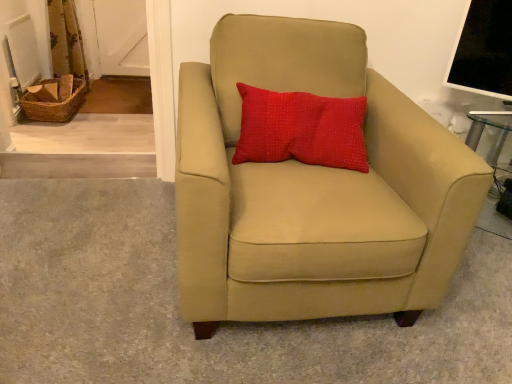
Describe the element at coordinates (314, 189) in the screenshot. The width and height of the screenshot is (512, 384). I see `suede beige armchair at center` at that location.

You are a GUI agent. You are given a task and a screenshot of the screen. Output one action in this format:
    pyautogui.click(x=<x>, y=<y>)
    Task: Click on the red textured pillow at upper center
    The height and width of the screenshot is (384, 512).
    Given the screenshot: What is the action you would take?
    pyautogui.click(x=301, y=129)

Image resolution: width=512 pixels, height=384 pixels. I want to click on suede beige armchair at center, so click(x=314, y=189).

Is floral fabric curtain at upper left bigger than red textured pillow at upper center?

Yes.

In the image, is floral fabric curtain at upper left positioned in front of or behind red textured pillow at upper center?

Clearly, floral fabric curtain at upper left is behind red textured pillow at upper center.

Between point (82, 42) and point (269, 160), which one is positioned in front?

The point (269, 160) is closer.

From a real-world perspective, is floral fabric curtain at upper left positioned above or below red textured pillow at upper center?

In terms of real-world spatial position, floral fabric curtain at upper left is below red textured pillow at upper center.

There is a floral fabric curtain at upper left. Where is `pillow above it (from a real-world perspective)`? pillow above it (from a real-world perspective) is located at coordinates (301, 129).

Does red textured pillow at upper center have a smaller size compared to floral fabric curtain at upper left?

Correct, red textured pillow at upper center occupies less space than floral fabric curtain at upper left.

From a real-world perspective, which is physically above, red textured pillow at upper center or floral fabric curtain at upper left?

In real-world perspective, red textured pillow at upper center is above.

Is red textured pillow at upper center not close to floral fabric curtain at upper left?

Yes, red textured pillow at upper center and floral fabric curtain at upper left are quite far apart.

Can you confirm if red textured pillow at upper center is taller than suede beige armchair at center?

No.

From the image's perspective, relative to suede beige armchair at center, is red textured pillow at upper center above or below?

red textured pillow at upper center is situated higher than suede beige armchair at center in the image.

Between red textured pillow at upper center and suede beige armchair at center, which one has larger width?

With larger width is suede beige armchair at center.

Is suede beige armchair at center completely or partially inside red textured pillow at upper center?

Definitely not — suede beige armchair at center is not inside red textured pillow at upper center.

Considering the sizes of floral fabric curtain at upper left and suede beige armchair at center in the image, is floral fabric curtain at upper left taller or shorter than suede beige armchair at center?

Considering their sizes, floral fabric curtain at upper left has less height than suede beige armchair at center.

Between point (53, 35) and point (288, 81), which one is positioned behind?

The point (53, 35) is farther from the camera.

Is floral fabric curtain at upper left aimed at suede beige armchair at center?

No, floral fabric curtain at upper left is not aimed at suede beige armchair at center.

Between floral fabric curtain at upper left and suede beige armchair at center, which one has larger width?

suede beige armchair at center.

Looking at the image, does suede beige armchair at center seem bigger or smaller compared to red textured pillow at upper center?

In the image, suede beige armchair at center appears to be larger than red textured pillow at upper center.

Is suede beige armchair at center inside the boundaries of red textured pillow at upper center, or outside?

suede beige armchair at center exists outside the volume of red textured pillow at upper center.

In terms of width, does suede beige armchair at center look wider or thinner when compared to red textured pillow at upper center?

In the image, suede beige armchair at center appears to be wider than red textured pillow at upper center.

Looking at this image, is suede beige armchair at center oriented towards floral fabric curtain at upper left?

No, suede beige armchair at center does not turn towards floral fabric curtain at upper left.

Is suede beige armchair at center beside floral fabric curtain at upper left?

suede beige armchair at center and floral fabric curtain at upper left are clearly separated.

Image resolution: width=512 pixels, height=384 pixels. Identify the location of curtain above the suede beige armchair at center (from the image's perspective). coord(66,41).

In the image, is suede beige armchair at center positioned in front of or behind floral fabric curtain at upper left?

suede beige armchair at center is positioned closer to the viewer than floral fabric curtain at upper left.

Where is `curtain behind the red textured pillow at upper center`? The width and height of the screenshot is (512, 384). curtain behind the red textured pillow at upper center is located at coordinates (66, 41).

I want to click on pillow above the floral fabric curtain at upper left (from a real-world perspective), so click(301, 129).

Considering their positions, is suede beige armchair at center positioned closer to floral fabric curtain at upper left than red textured pillow at upper center?

The object closer to floral fabric curtain at upper left is red textured pillow at upper center.

Estimate the real-world distances between objects in this image. Which object is closer to suede beige armchair at center, floral fabric curtain at upper left or red textured pillow at upper center?

Based on the image, red textured pillow at upper center appears to be nearer to suede beige armchair at center.

Which object lies nearer to the anchor point red textured pillow at upper center, suede beige armchair at center or floral fabric curtain at upper left?

suede beige armchair at center is closer to red textured pillow at upper center.

Which object lies nearer to the anchor point red textured pillow at upper center, floral fabric curtain at upper left or suede beige armchair at center?

Based on the image, suede beige armchair at center appears to be nearer to red textured pillow at upper center.

When comparing their distances from floral fabric curtain at upper left, does red textured pillow at upper center or suede beige armchair at center seem closer?

red textured pillow at upper center lies closer to floral fabric curtain at upper left than the other object.

Based on their spatial positions, is red textured pillow at upper center or floral fabric curtain at upper left closer to suede beige armchair at center?

red textured pillow at upper center is positioned closer to the anchor suede beige armchair at center.

Where is `pillow between suede beige armchair at center and floral fabric curtain at upper left along the z-axis`? pillow between suede beige armchair at center and floral fabric curtain at upper left along the z-axis is located at coordinates (301, 129).